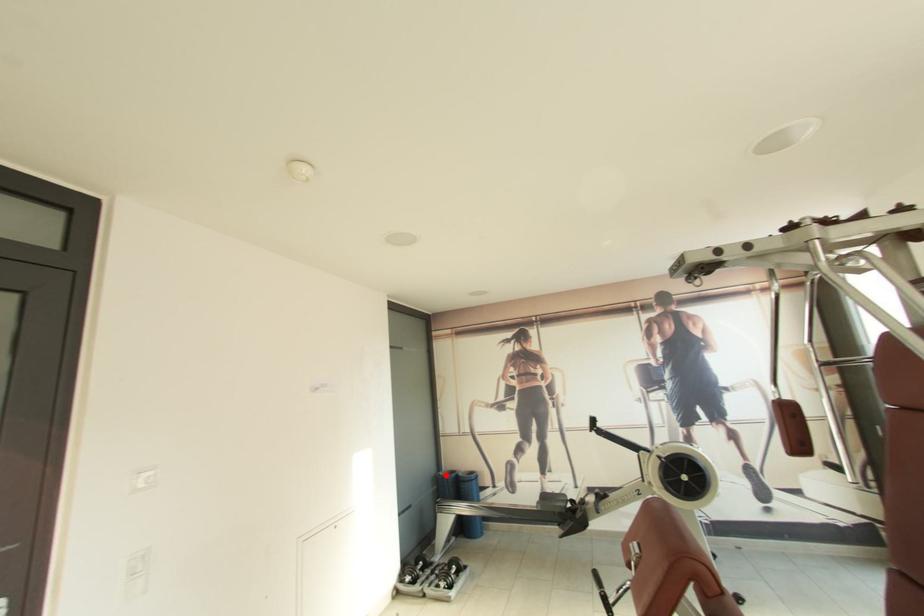
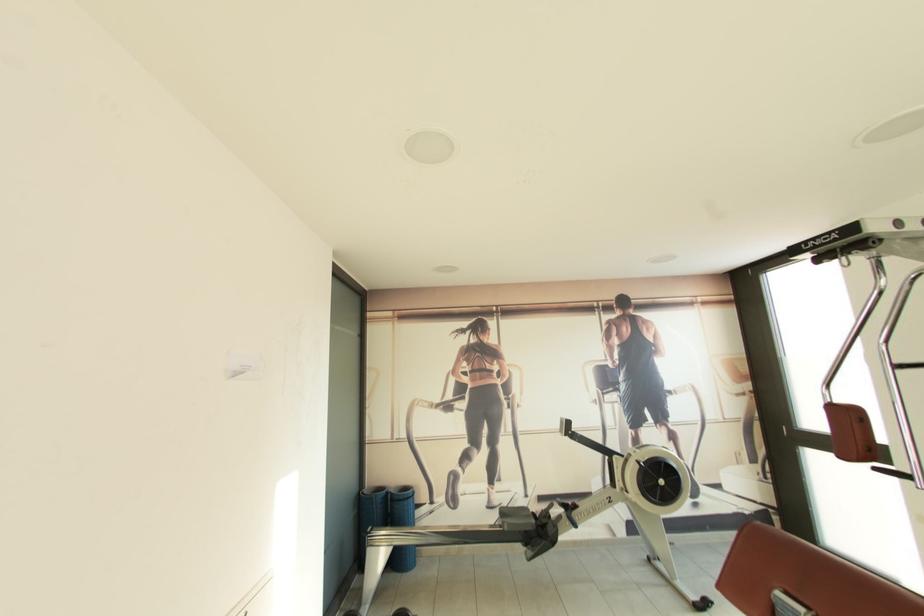
Locate, in the second image, the point that corresponds to the highlighted location in the first image.

(371, 493)